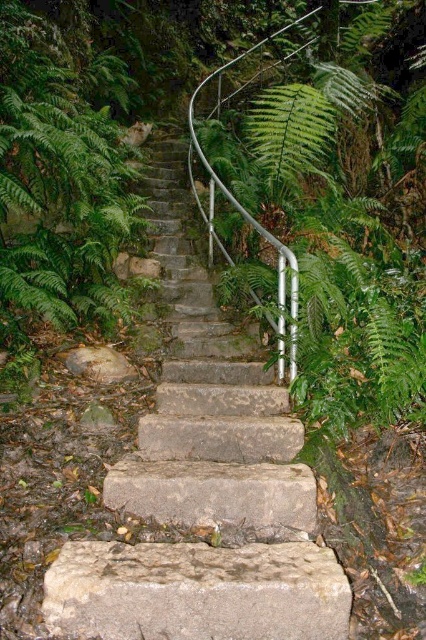
Does stone stairs at center have a lesser width compared to gray rough stone at center?

Indeed, stone stairs at center has a lesser width compared to gray rough stone at center.

Between stone stairs at center and gray rough stone at center, which one has more height?

stone stairs at center is taller.

The height and width of the screenshot is (640, 426). I want to click on stone stairs at center, so (x=204, y=490).

Locate an element on the screen. The image size is (426, 640). stone stairs at center is located at coordinates (204, 490).

Is stone stairs at center bigger than green leafy fern at upper center?

Indeed, stone stairs at center has a larger size compared to green leafy fern at upper center.

Between point (267, 589) and point (301, 118), which one is positioned in front?

Point (267, 589)

What are the coordinates of `stone stairs at center` in the screenshot? It's located at (204, 490).

You are a GUI agent. You are given a task and a screenshot of the screen. Output one action in this format:
    pyautogui.click(x=<x>, y=<y>)
    Task: Click on the stone stairs at center
    The width and height of the screenshot is (426, 640).
    Given the screenshot: What is the action you would take?
    pyautogui.click(x=204, y=490)

Which is more to the right, gray rough stone at center or green leafy fern at upper center?

Positioned to the right is green leafy fern at upper center.

Which is in front, point (46, 570) or point (273, 154)?

Positioned in front is point (46, 570).

Where is `gray rough stone at center`? The image size is (426, 640). gray rough stone at center is located at coordinates (196, 592).